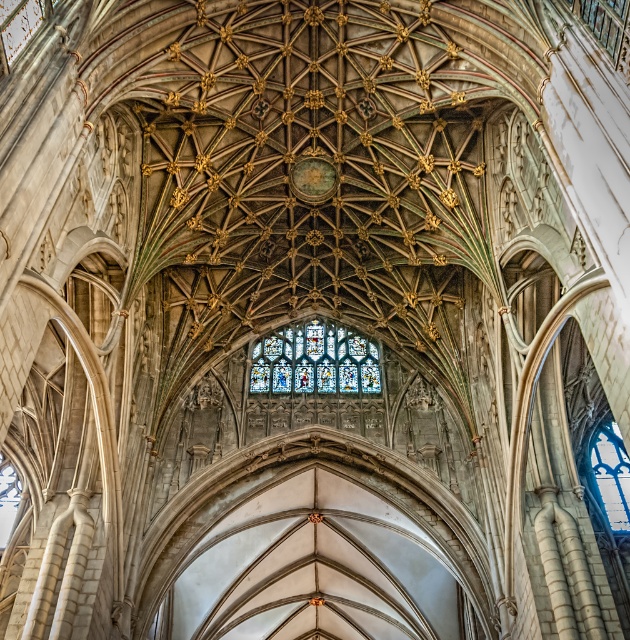
You are standing inside the cathedral and looking up at the ceiling. There are two points marked on the ceiling, one at coordinates point [277,392] and the other at point [612,428]. Which of these two points appears closer to your eyes?

The point at coordinates point [277,392] appears closer to your eyes because it is closer to the camera than point [612,428].

You are a drone operator tasked with capturing aerial footage of the cathedral. Your drone has a maximum flight range of 50 meters. If you are positioned at the stained glass at center, can your drone reach the blue glass window at center without exceeding its range?

The distance between the stained glass at center and the blue glass window at center is 53.98 meters, which exceeds the drone operator drone maximum flight range of 50 meters. Therefore, the drone cannot reach the blue glass window at center from the stained glass at center without exceeding its range.

You are an architect analyzing the cathedral ceiling. You observe the stained glass at center and the blue glass window at center. Which one has a greater height?

The blue glass window at center has a greater height than the stained glass at center.